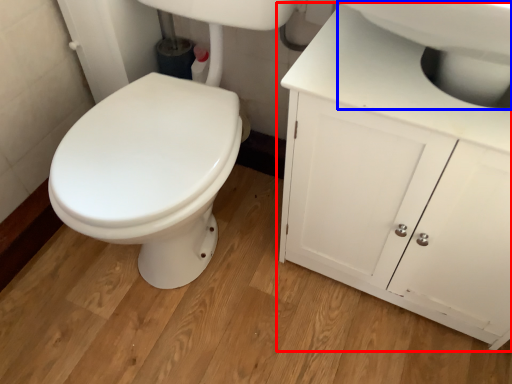
Question: Which of the following is the farthest to the observer, bathroom cabinet (highlighted by a red box) or sink (highlighted by a blue box)?

Choices:
 (A) bathroom cabinet
 (B) sink

Answer: (A)